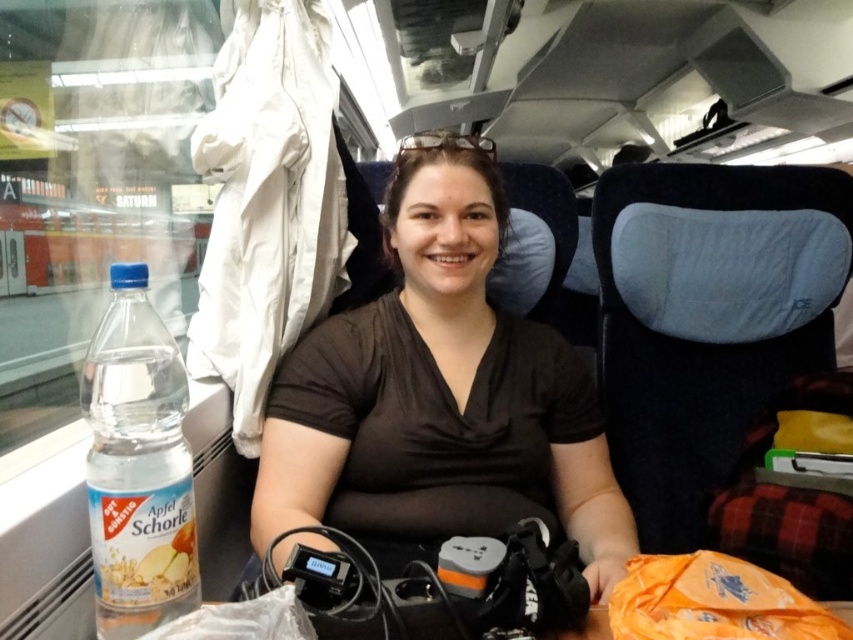
The image size is (853, 640). Describe the element at coordinates (137, 465) in the screenshot. I see `clear plastic bottle at left` at that location.

Is clear plastic bottle at left shorter than orange fabric bag at lower right?

In fact, clear plastic bottle at left may be taller than orange fabric bag at lower right.

Locate an element on the screen. clear plastic bottle at left is located at coordinates (137, 465).

From the picture: Between black matte shirt at center and clear plastic bottle at left, which one appears on the right side from the viewer's perspective?

From the viewer's perspective, black matte shirt at center appears more on the right side.

Is black matte shirt at center to the right of clear plastic bottle at left from the viewer's perspective?

Indeed, black matte shirt at center is positioned on the right side of clear plastic bottle at left.

Find the location of `black matte shirt at center`. black matte shirt at center is located at coordinates (439, 385).

Identify the location of black matte shirt at center. (439, 385).

Does black matte shirt at center come behind translucent plastic bottle at lower left?

That is True.

This screenshot has width=853, height=640. Find the location of `black matte shirt at center`. black matte shirt at center is located at coordinates (439, 385).

At what (x,y) coordinates should I click in order to perform the action: click on black matte shirt at center. Please return your answer as a coordinate pair (x, y). Looking at the image, I should click on (439, 385).